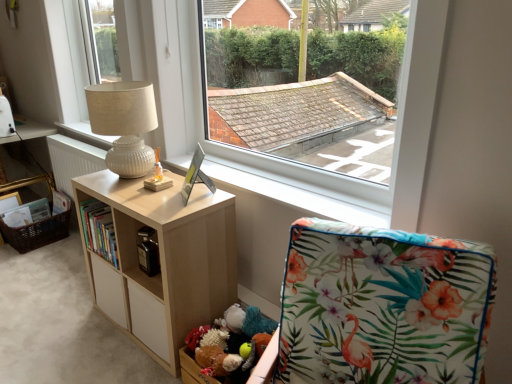
Question: Is brown woven basket at lower left far away from hardcover book at center?

Choices:
 (A) yes
 (B) no

Answer: (A)

Question: Can you see brown woven basket at lower left touching hardcover book at center?

Choices:
 (A) no
 (B) yes

Answer: (A)

Question: Does brown woven basket at lower left have a lesser height compared to hardcover book at center?

Choices:
 (A) yes
 (B) no

Answer: (B)

Question: From the image's perspective, is brown woven basket at lower left on hardcover book at center?

Choices:
 (A) yes
 (B) no

Answer: (B)

Question: From the image's perspective, would you say brown woven basket at lower left is shown under hardcover book at center?

Choices:
 (A) yes
 (B) no

Answer: (A)

Question: Is brown woven basket at lower left outside hardcover book at center?

Choices:
 (A) no
 (B) yes

Answer: (B)

Question: Does beige fabric lampshade at upper left, the 1th window from the back, appear on the left side of hardcover book at center?

Choices:
 (A) yes
 (B) no

Answer: (A)

Question: From the image's perspective, is beige fabric lampshade at upper left, the second window from the right, located beneath hardcover book at center?

Choices:
 (A) yes
 (B) no

Answer: (B)

Question: Can you confirm if beige fabric lampshade at upper left, the second window from the right, is smaller than hardcover book at center?

Choices:
 (A) no
 (B) yes

Answer: (A)

Question: Is beige fabric lampshade at upper left, marked as the 2th window in a front-to-back arrangement, positioned in front of hardcover book at center?

Choices:
 (A) yes
 (B) no

Answer: (B)

Question: From a real-world perspective, is beige fabric lampshade at upper left, marked as the 2th window in a front-to-back arrangement, positioned under hardcover book at center based on gravity?

Choices:
 (A) no
 (B) yes

Answer: (A)

Question: Is beige fabric lampshade at upper left, the second window from the right, looking in the opposite direction of hardcover book at center?

Choices:
 (A) no
 (B) yes

Answer: (A)

Question: Is white glossy radiator at left at the right side of light wood/texture bookshelf at center?

Choices:
 (A) no
 (B) yes

Answer: (A)